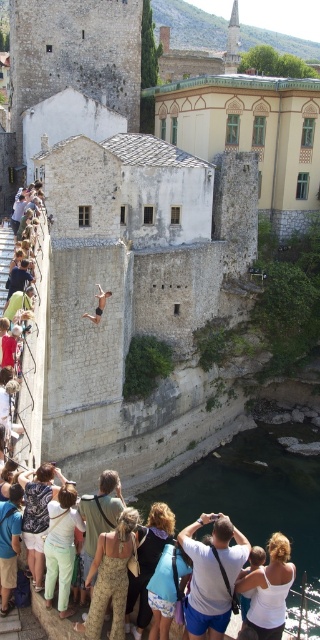
You are standing at the point labeled point (89, 628) and want to walk to the point labeled point (282, 625). Given that the path between them is clear, will you be moving towards the bridge or away from it?

Since point (89, 628) is behind point (282, 625), moving from point (89, 628) to point (282, 625) would mean moving towards the bridge.

In the scene shown: You are a photographer standing on the platform on the left side of the Stari Most bridge. You notice a person wearing a white cotton shirt at center and a person carrying a camouflage backpack at center. Which of these two items is closer to the edge of the bridge?

The white cotton shirt at center is located below the camouflage backpack at center, meaning the person wearing the white cotton shirt is closer to the edge of the bridge.